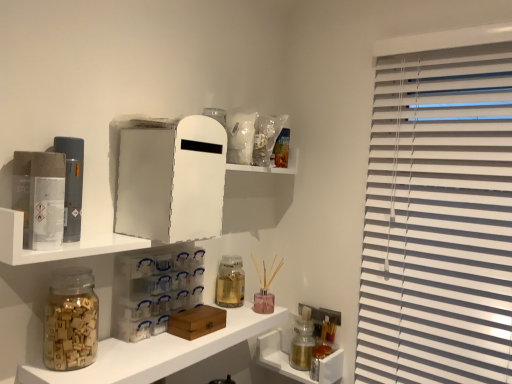
You are a GUI agent. You are given a task and a screenshot of the screen. Output one action in this format:
    pyautogui.click(x=<x>, y=<y>)
    Task: Click on the empty space that is ontop of metallic silver canisters at lower right, marked as the 1th cabinet in a right-to-left arrangement
    The width and height of the screenshot is (512, 384).
    Given the screenshot: What is the action you would take?
    pyautogui.click(x=300, y=338)